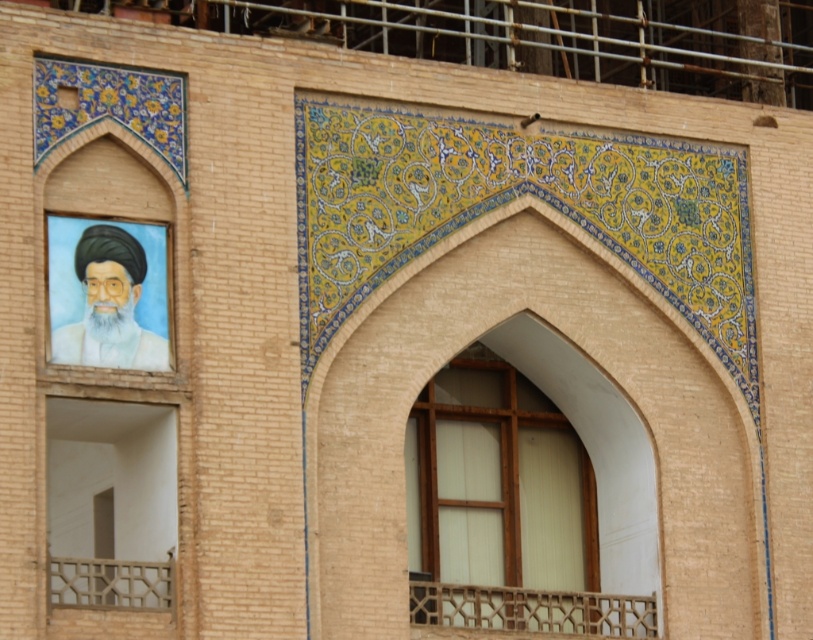
Does wooden at center have a smaller size compared to white matte robe at left?

Indeed, wooden at center has a smaller size compared to white matte robe at left.

Does wooden at center have a lesser width compared to white matte robe at left?

Indeed, wooden at center has a lesser width compared to white matte robe at left.

Is point (411, 426) farther from camera compared to point (148, 353)?

That is True.

Locate an element on the screen. This screenshot has height=640, width=813. wooden at center is located at coordinates (498, 500).

Is point (512, 548) more distant than point (122, 285)?

Yes, it is behind point (122, 285).

Does wooden at center appear on the left side of matte oil painting portrait at upper left?

Incorrect, wooden at center is not on the left side of matte oil painting portrait at upper left.

Is point (451, 401) positioned in front of point (93, 250)?

No.

Where is `wooden at center`? Image resolution: width=813 pixels, height=640 pixels. wooden at center is located at coordinates (498, 500).

The height and width of the screenshot is (640, 813). In order to click on wooden lattice at lower center in this screenshot , I will do `click(529, 609)`.

Consider the image. Measure the distance between wooden lattice at lower center and wooden lattice balcony at lower left.

wooden lattice at lower center is 18.59 feet from wooden lattice balcony at lower left.

Where is `wooden lattice at lower center`? The image size is (813, 640). wooden lattice at lower center is located at coordinates (529, 609).

The height and width of the screenshot is (640, 813). Find the location of `wooden lattice at lower center`. wooden lattice at lower center is located at coordinates [529, 609].